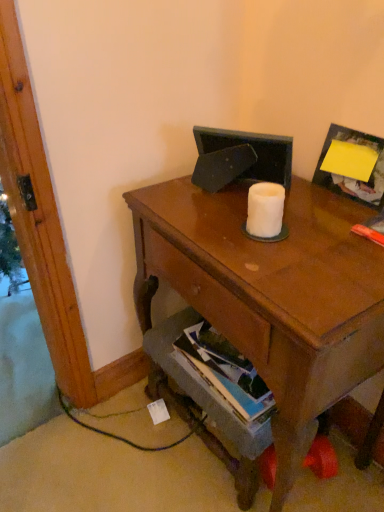
Question: Are hardcover book at lower center and yellow paper at upper right making contact?

Choices:
 (A) no
 (B) yes

Answer: (A)

Question: Considering the relative positions of hardcover book at lower center and yellow paper at upper right in the image provided, is hardcover book at lower center to the right of yellow paper at upper right from the viewer's perspective?

Choices:
 (A) no
 (B) yes

Answer: (A)

Question: Is hardcover book at lower center positioned behind yellow paper at upper right?

Choices:
 (A) yes
 (B) no

Answer: (A)

Question: Considering the relative sizes of hardcover book at lower center and yellow paper at upper right in the image provided, is hardcover book at lower center bigger than yellow paper at upper right?

Choices:
 (A) no
 (B) yes

Answer: (B)

Question: Does hardcover book at lower center come in front of yellow paper at upper right?

Choices:
 (A) no
 (B) yes

Answer: (A)

Question: Is there a large distance between hardcover book at lower center and yellow paper at upper right?

Choices:
 (A) no
 (B) yes

Answer: (A)

Question: Can you confirm if matte brown desk at center is taller than hardcover book at lower center?

Choices:
 (A) no
 (B) yes

Answer: (B)

Question: Can you confirm if matte brown desk at center is positioned to the right of hardcover book at lower center?

Choices:
 (A) yes
 (B) no

Answer: (A)

Question: Are matte brown desk at center and hardcover book at lower center located far from each other?

Choices:
 (A) no
 (B) yes

Answer: (A)

Question: Is matte brown desk at center looking in the opposite direction of hardcover book at lower center?

Choices:
 (A) no
 (B) yes

Answer: (B)

Question: Is matte brown desk at center positioned behind hardcover book at lower center?

Choices:
 (A) yes
 (B) no

Answer: (B)

Question: Is the position of matte brown desk at center less distant than that of hardcover book at lower center?

Choices:
 (A) yes
 (B) no

Answer: (A)

Question: From the image's perspective, is hardcover book at lower center located above white matte toilet paper at center?

Choices:
 (A) yes
 (B) no

Answer: (B)